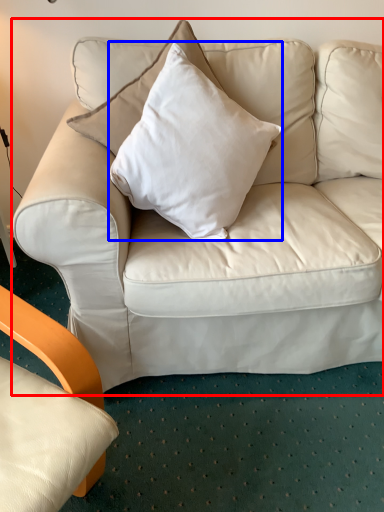
Question: Which object is closer to the camera taking this photo, studio couch (highlighted by a red box) or pillow (highlighted by a blue box)?

Choices:
 (A) studio couch
 (B) pillow

Answer: (B)